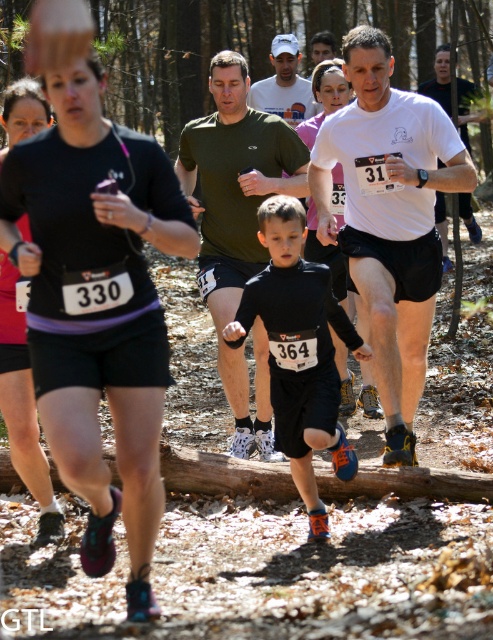
Is white matte t-shirt at center smaller than white matte shirt at upper center?

Incorrect, white matte t-shirt at center is not smaller in size than white matte shirt at upper center.

Based on the photo, between white matte t-shirt at center and white matte shirt at upper center, which one appears on the left side from the viewer's perspective?

From the viewer's perspective, white matte shirt at upper center appears more on the left side.

Where is `white matte t-shirt at center`? This screenshot has height=640, width=493. white matte t-shirt at center is located at coordinates (389, 218).

What do you see at coordinates (98, 307) in the screenshot? I see `black matte shorts at left` at bounding box center [98, 307].

Between black matte shorts at left and white matte t-shirt at center, which one is positioned higher?

white matte t-shirt at center is higher up.

Between point (133, 513) and point (428, 170), which one is positioned in front?

Positioned in front is point (133, 513).

In order to click on black matte shorts at left in this screenshot , I will do click(98, 307).

Based on the photo, can you confirm if white matte t-shirt at center is bigger than black matte running suit at center?

Yes.

Which is behind, point (383, 182) or point (295, 314)?

The point (383, 182) is more distant.

Locate an element on the screen. The image size is (493, 640). white matte t-shirt at center is located at coordinates (389, 218).